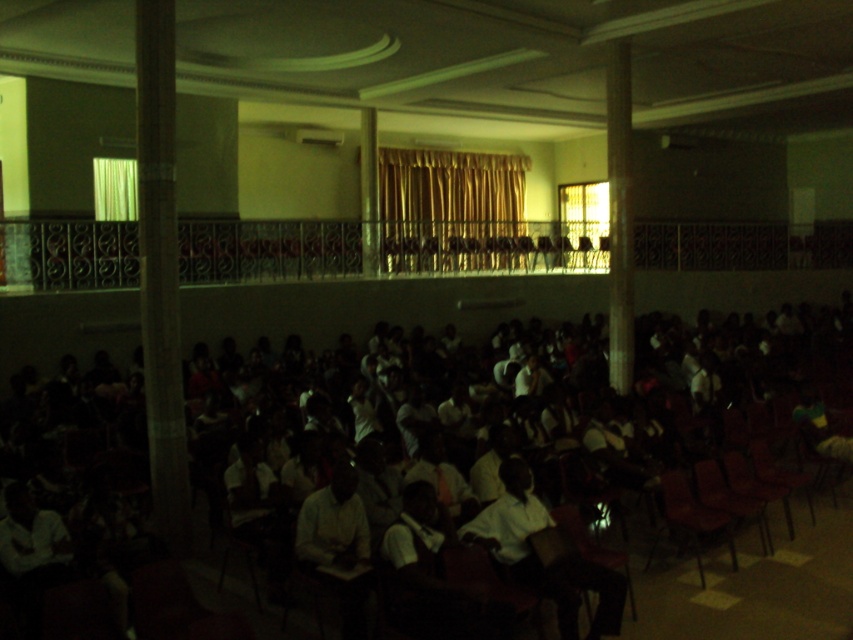
You are organizing a small group discussion and need to choose between the metallic brown chair at lower right and the matte brown chair at center for seating. Which chair offers more space for someone sitting next to it?

The metallic brown chair at lower right is wider than the matte brown chair at center, so it offers more space for someone sitting next to it.

You are attending a lecture in this room and need to sit down. You see a metallic brown chair at lower right and a brown leather chair at lower right. Which chair is taller?

The metallic brown chair at lower right is taller than the brown leather chair at lower right according to the description.

You are standing in the front of the lecture hall and want to move towards the back. There is a point marked at coordinates (x=689, y=516) which corresponds to a metallic brown chair at lower right. Can you walk straight from your current position to this chair without needing to navigate around any obstacles?

The point (x=689, y=516) marks the metallic brown chair at lower right. Since the red chairs are arranged in neat rows, there may be rows of chairs between you and the target chair. You would need to walk around the rows rather than going straight.